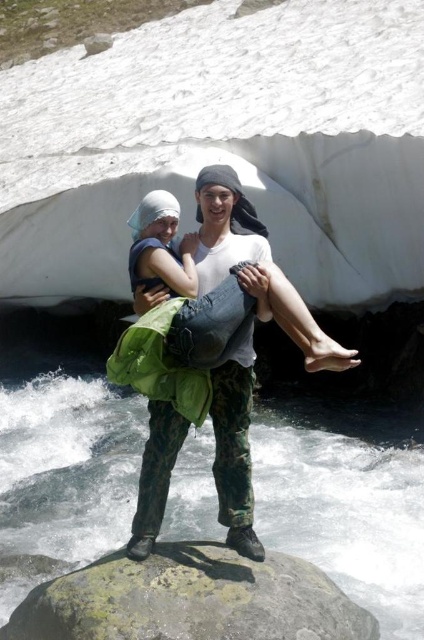
Question: Is the position of gray rough rock at center more distant than that of light green fabric skirt at center?

Choices:
 (A) no
 (B) yes

Answer: (A)

Question: Can you confirm if gray rough rock at center is positioned to the right of light green fabric skirt at center?

Choices:
 (A) yes
 (B) no

Answer: (B)

Question: Is gray rough rock at center wider than light green fabric skirt at center?

Choices:
 (A) no
 (B) yes

Answer: (B)

Question: Which object appears farthest from the camera in this image?

Choices:
 (A) gray rough rock at center
 (B) light green fabric skirt at center

Answer: (B)